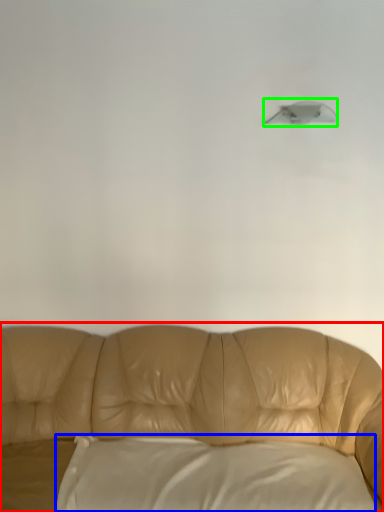
Question: Which object is positioned farthest from studio couch (highlighted by a red box)? Select from pillow (highlighted by a blue box) and lamp (highlighted by a green box).

Choices:
 (A) pillow
 (B) lamp

Answer: (B)